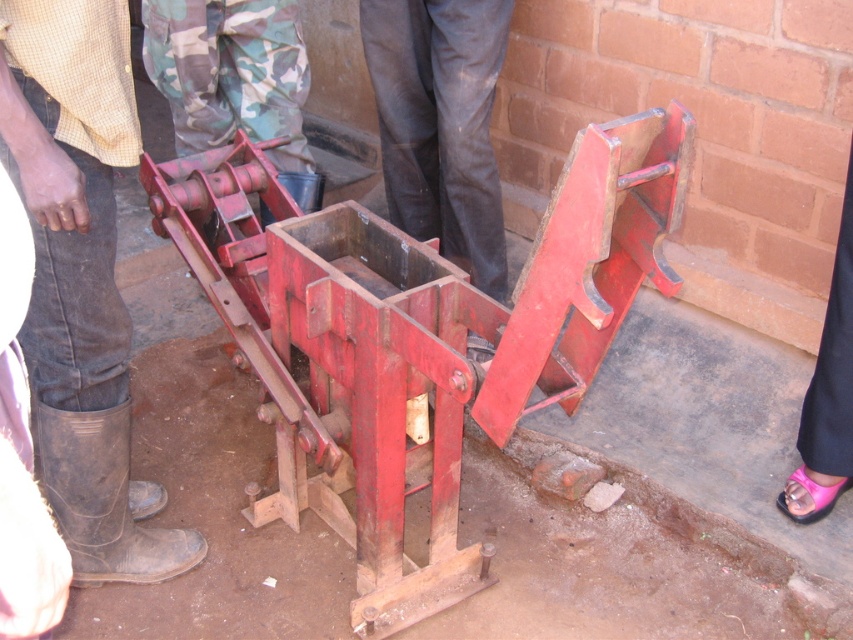
Question: Does pink leather sandal at lower right lie behind pink fabric sandal at lower right?

Choices:
 (A) yes
 (B) no

Answer: (B)

Question: Which is farther from the brown leather boots at lower left?

Choices:
 (A) pink fabric sandal at lower right
 (B) rusty metal press at center
 (C) pink leather sandal at lower right

Answer: (A)

Question: Is rusty metal press at center further to camera compared to pink leather sandal at lower right?

Choices:
 (A) yes
 (B) no

Answer: (B)

Question: Does brown leather boots at lower left have a greater width compared to pink fabric sandal at lower right?

Choices:
 (A) no
 (B) yes

Answer: (B)

Question: Among these objects, which one is nearest to the camera?

Choices:
 (A) brown leather boots at lower left
 (B) rusty metal press at center
 (C) pink leather sandal at lower right

Answer: (B)

Question: Which of the following is the closest to the observer?

Choices:
 (A) brown leather boots at lower left
 (B) pink leather sandal at lower right
 (C) rusty metal press at center

Answer: (C)